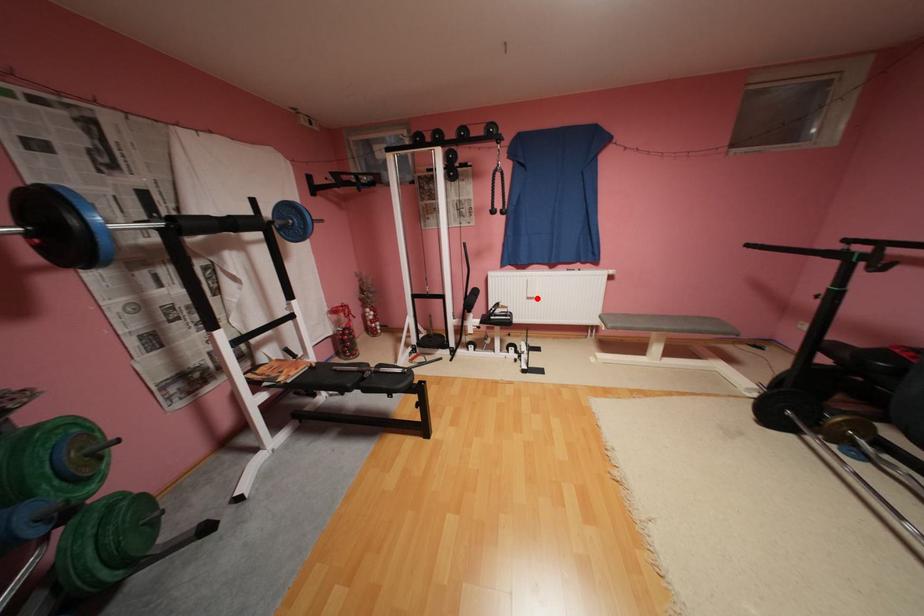
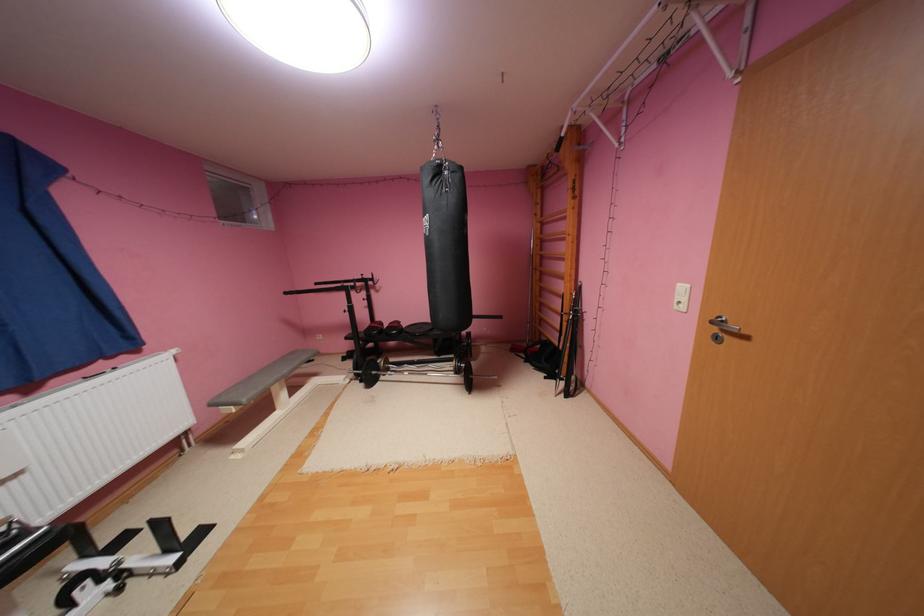
Question: A red point is marked in image1. In image2, is the corresponding 3D point closer to the camera or farther? Reply with the corresponding letter.

Choices:
 (A) The corresponding 3D point is closer.
 (B) The corresponding 3D point is farther.

Answer: (B)